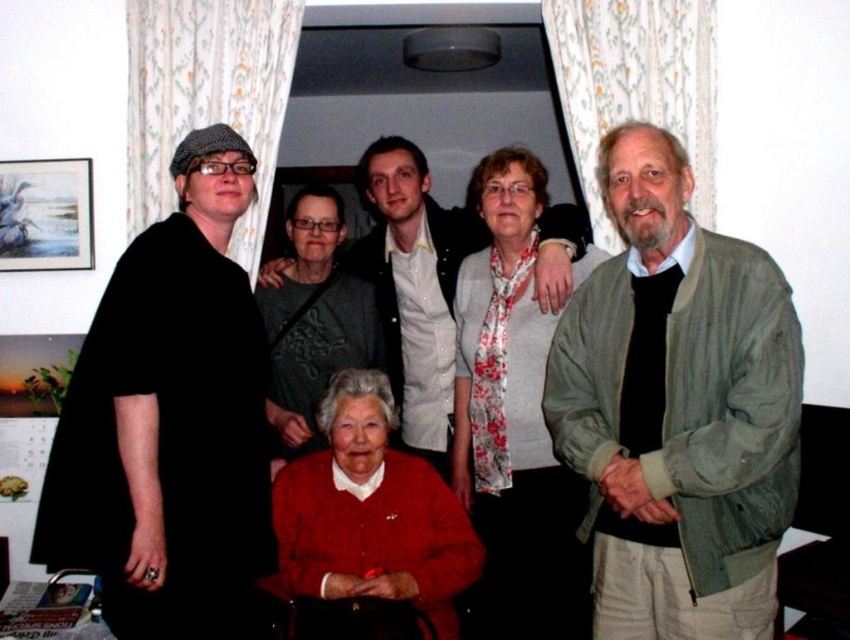
Question: Which object is farther from the camera taking this photo?

Choices:
 (A) matte black jacket at left
 (B) light olive-green jacket at right

Answer: (A)

Question: In this image, where is red knit sweater at lower center located relative to dark gray fabric at upper center?

Choices:
 (A) left
 (B) right

Answer: (B)

Question: Does light brown leather jacket at center have a larger size compared to dark gray fabric at upper center?

Choices:
 (A) yes
 (B) no

Answer: (A)

Question: Estimate the real-world distances between objects in this image. Which object is farther from the red knit sweater at lower center?

Choices:
 (A) light olive-green jacket at right
 (B) white floral scarf at upper center
 (C) matte black jacket at left
 (D) light brown leather jacket at center

Answer: (A)

Question: Considering the real-world distances, which object is closest to the dark gray fabric at upper center?

Choices:
 (A) light brown leather jacket at center
 (B) light olive-green jacket at right
 (C) red knit sweater at lower center

Answer: (A)

Question: Is light olive-green jacket at right in front of black matte dress at left?

Choices:
 (A) yes
 (B) no

Answer: (A)